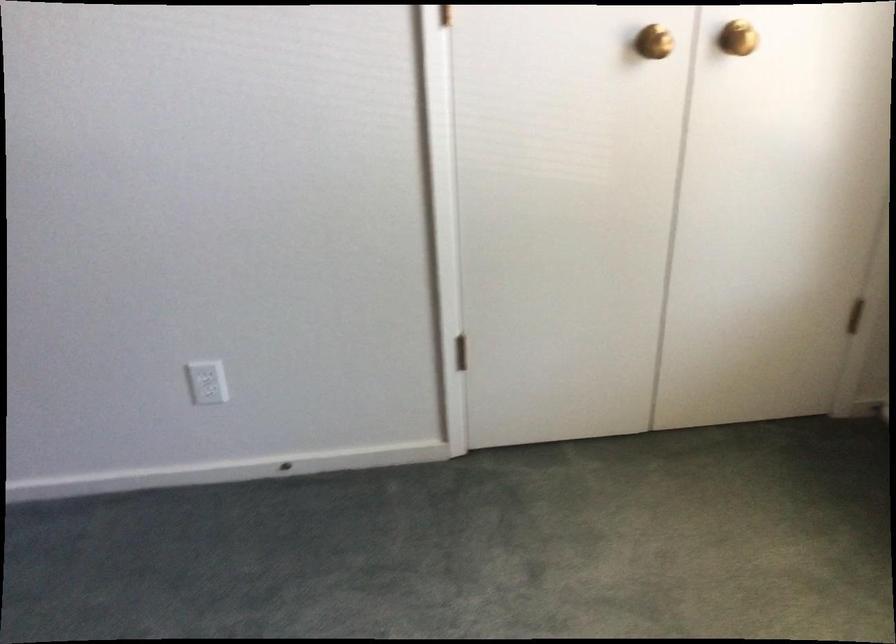
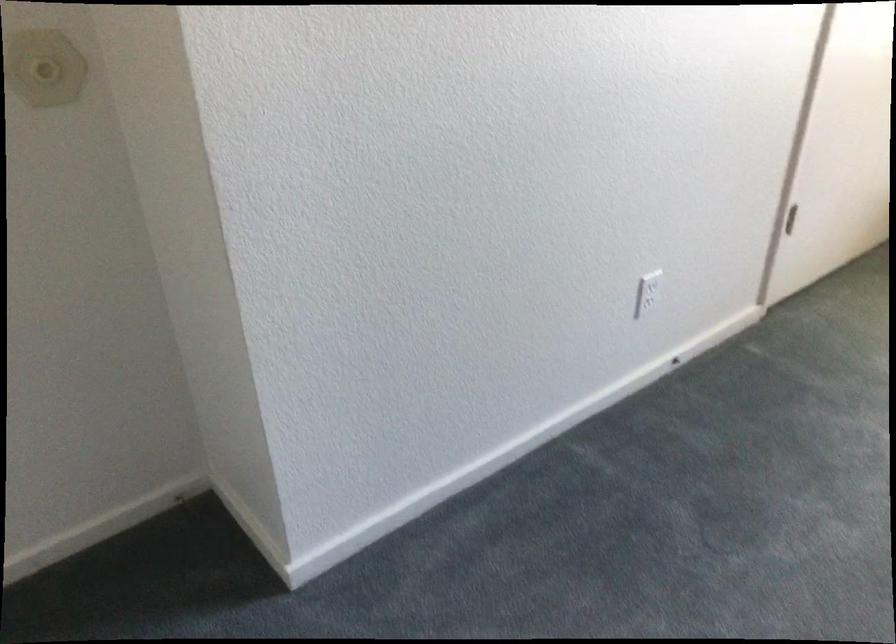
Find the pixel in the second image that matches (216,377) in the first image.

(650, 285)